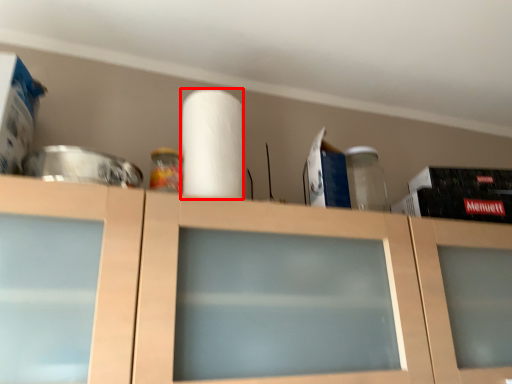
Question: In this image, where is paper towel (annotated by the red box) located relative to cabinetry?

Choices:
 (A) right
 (B) left

Answer: (B)